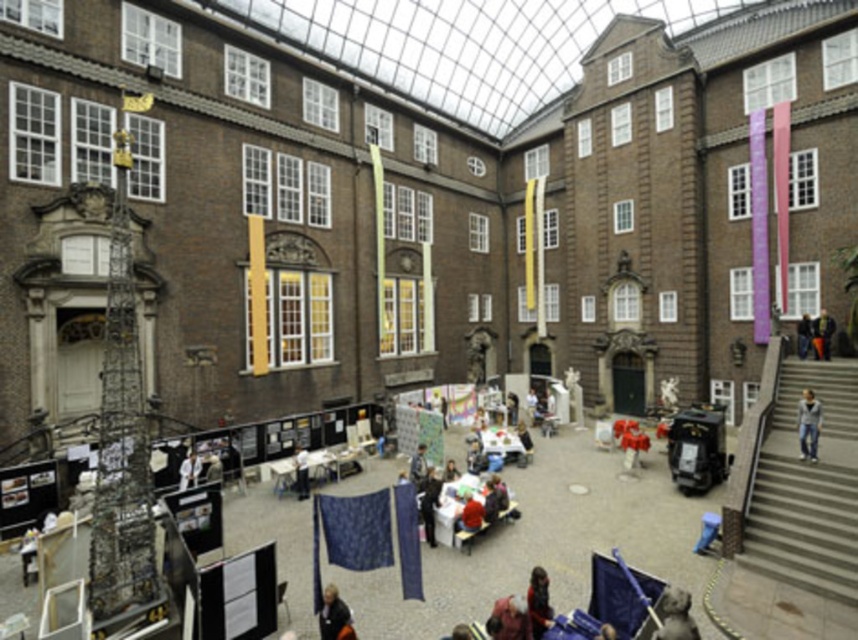
Does point (808, 429) come closer to viewer compared to point (801, 348)?

Yes.

Measure the distance between gray cotton jacket at lower right and dark blue jeans at lower right.

They are 60.99 feet apart.

Does point (814, 444) come behind point (804, 340)?

No, it is in front of (804, 340).

Locate an element on the screen. gray cotton jacket at lower right is located at coordinates (808, 424).

Is dark brown leather jacket at center wider than gray cotton jacket at lower right?

Yes, dark brown leather jacket at center is wider than gray cotton jacket at lower right.

Is dark brown leather jacket at center taller than gray cotton jacket at lower right?

Yes, dark brown leather jacket at center is taller than gray cotton jacket at lower right.

Who is more distant from viewer, (533,625) or (819,412)?

The point (819,412) is more distant.

At what (x,y) coordinates should I click in order to perform the action: click on dark brown leather jacket at center. Please return your answer as a coordinate pair (x, y). The image size is (858, 640). Looking at the image, I should click on (538, 602).

Which is in front, point (810, 456) or point (826, 328)?

Point (810, 456) is more forward.

Is point (807, 397) behind point (813, 355)?

No, it is not.

Locate an element on the screen. gray cotton jacket at lower right is located at coordinates (808, 424).